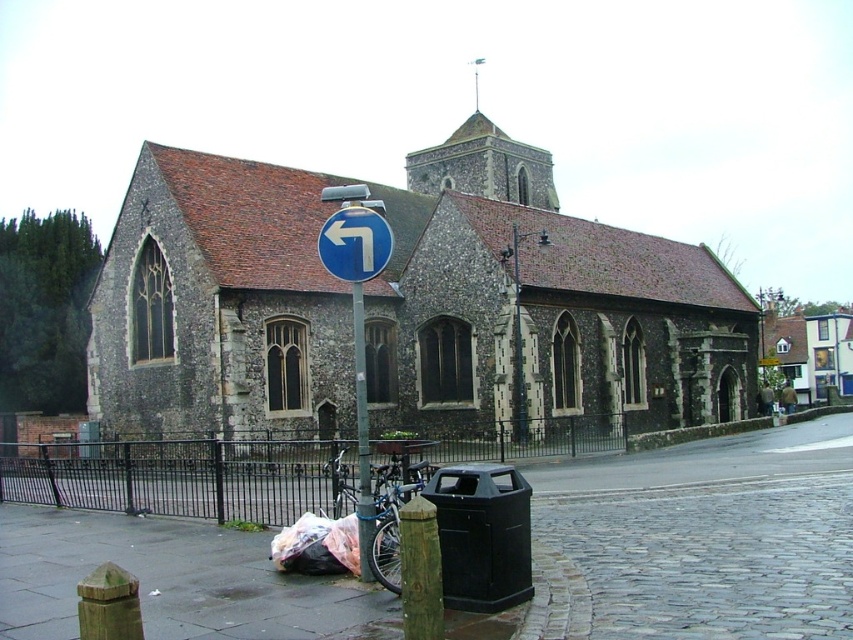
From the picture: You are a pedestrian standing on the smooth concrete pavement at lower left. You want to walk towards the green metallic pole at center. Is the pole directly above your current position?

Yes, the smooth concrete pavement at lower left is positioned under the green metallic pole at center, so the pole is directly above your current position.

You are a delivery person trying to park your blue metallic bicycle at lower left near the green metallic pole at center. Considering the space between them, can the bicycle fit without touching the pole?

The blue metallic bicycle at lower left is wider than the green metallic pole at center, so there might not be enough space for the bicycle to fit without touching the pole. Check the exact dimensions before parking.